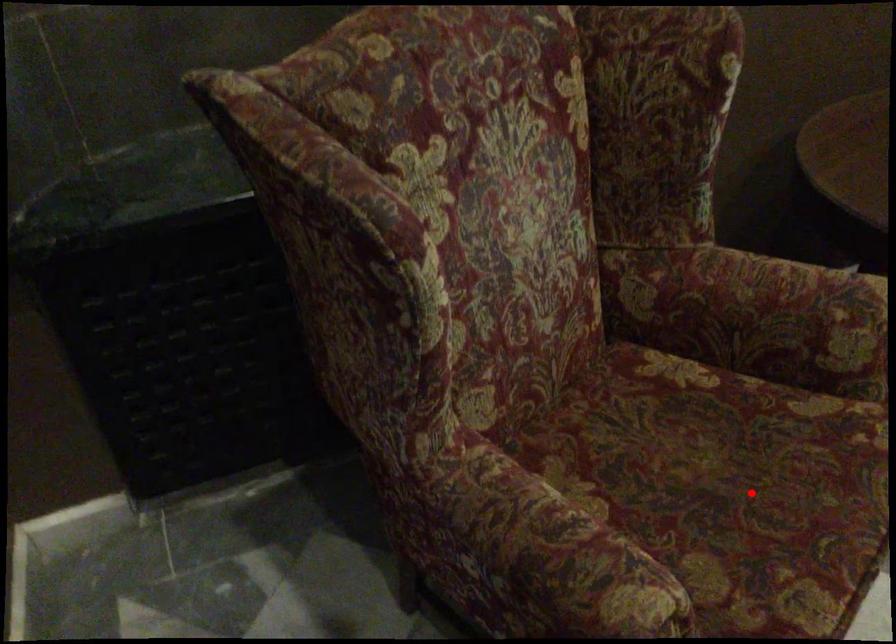
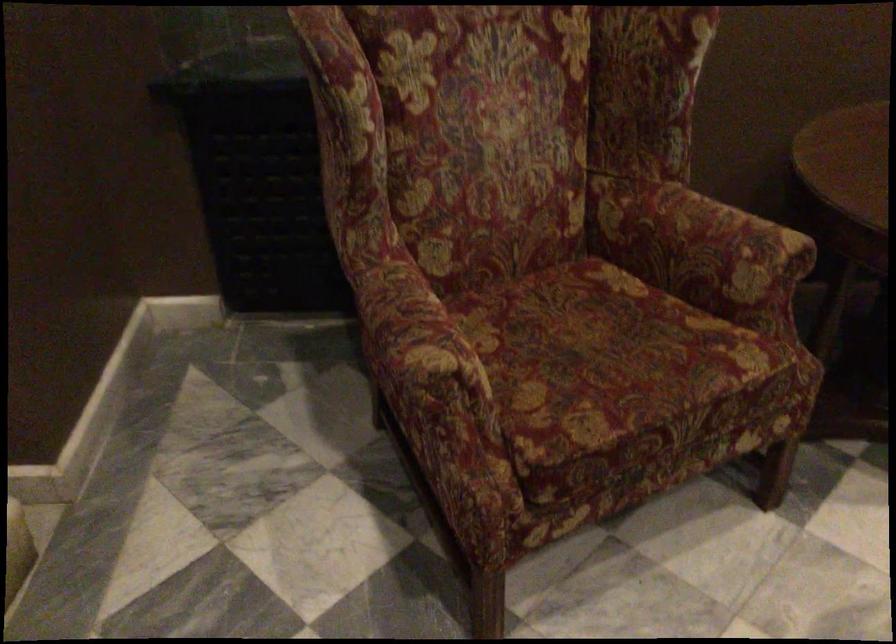
Question: I am providing you with two images of the same scene from different viewpoints. Image1 has a red point marked. In image2, the corresponding 3D location appears at what relative position? Reply with the corresponding letter.

Choices:
 (A) Closer
 (B) Farther

Answer: (B)